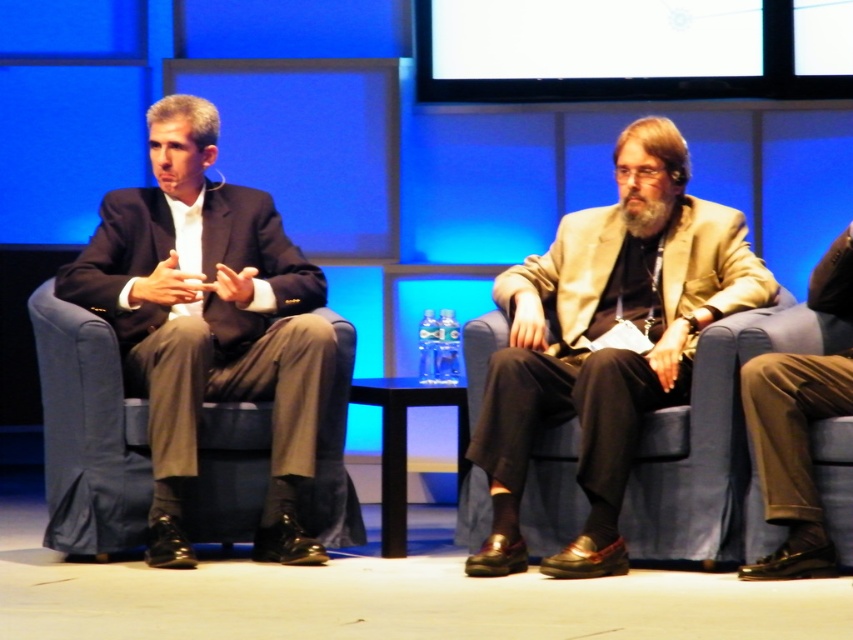
You are a photographer standing at the back of the stage. You want to take a photo of both the beige woolen blazer at center and the matte black suit at left. The camera you are using has a maximum focus range of 30 inches. Will you be able to capture both subjects clearly in the same frame without moving closer?

The beige woolen blazer at center is 35.68 inches away from the matte black suit at left. Since the camera can only focus up to 30 inches, the distance between them exceeds the maximum focus range. Therefore, you cannot capture both subjects clearly in the same frame without moving closer.

You are an event organizer checking the seating arrangement for a formal conference. You notice the beige woolen blazer at center and the matte black suit at left. Which of these two items is shorter in height?

The beige woolen blazer at center is shorter than the matte black suit at left, so the beige woolen blazer at center is the shorter one.